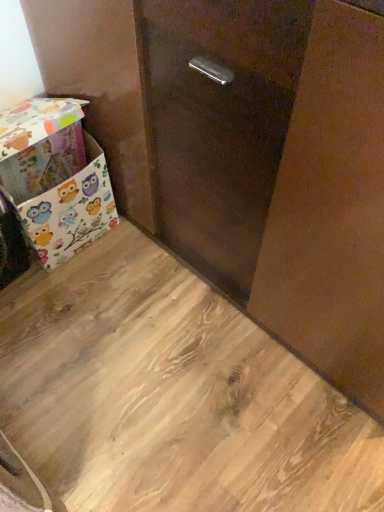
What are the coordinates of `vacant area on top of wooden floor at lower left (from a real-world perspective)` in the screenshot? It's located at click(145, 376).